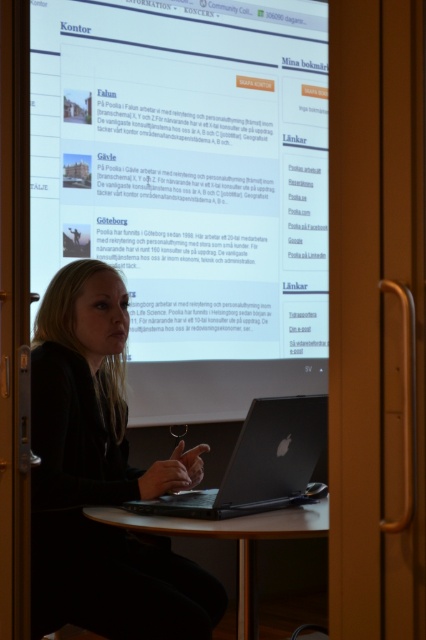
Between point (94, 525) and point (322, 502), which one is positioned behind?

The point (322, 502) is more distant.

Can you confirm if black matte jacket at center is smaller than brown wooden table at center?

No.

This screenshot has width=426, height=640. Find the location of `black matte jacket at center`. black matte jacket at center is located at coordinates pos(100,477).

Identify the location of black matte jacket at center. (100, 477).

Which is behind, point (256, 477) or point (316, 515)?

The point (256, 477) is behind.

Is sleek silver laptop at center thinner than brown wooden table at center?

Correct, sleek silver laptop at center's width is less than brown wooden table at center's.

Is point (284, 456) positioned in front of point (255, 605)?

Yes, it is in front of point (255, 605).

Locate an element on the screen. Image resolution: width=426 pixels, height=640 pixels. sleek silver laptop at center is located at coordinates (259, 464).

Is white glossy projection screen at upper center below brown wooden table at center?

No.

Who is shorter, white glossy projection screen at upper center or brown wooden table at center?

brown wooden table at center is shorter.

Is point (131, 362) more distant than point (281, 513)?

Yes, it is.

The height and width of the screenshot is (640, 426). What are the coordinates of `white glossy projection screen at upper center` in the screenshot? It's located at (189, 188).